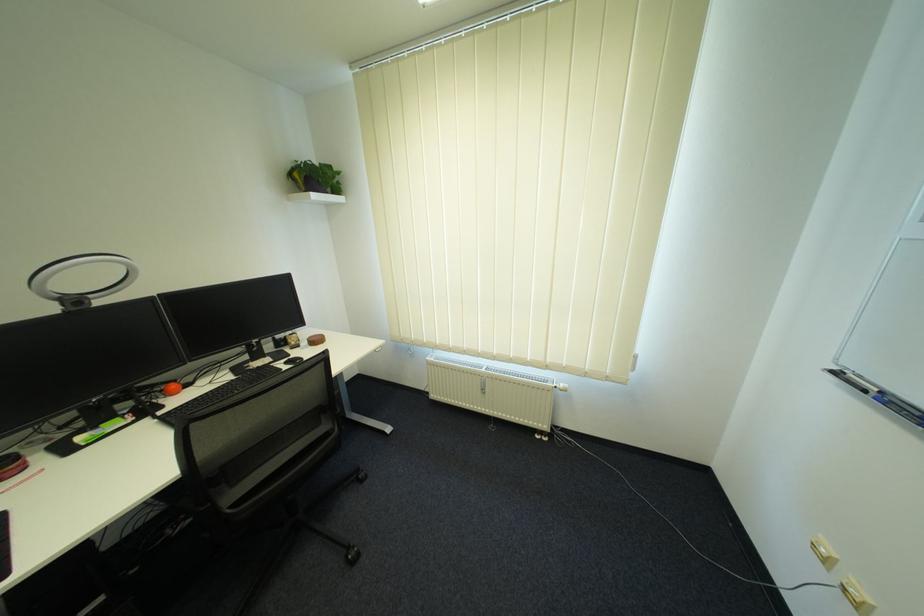
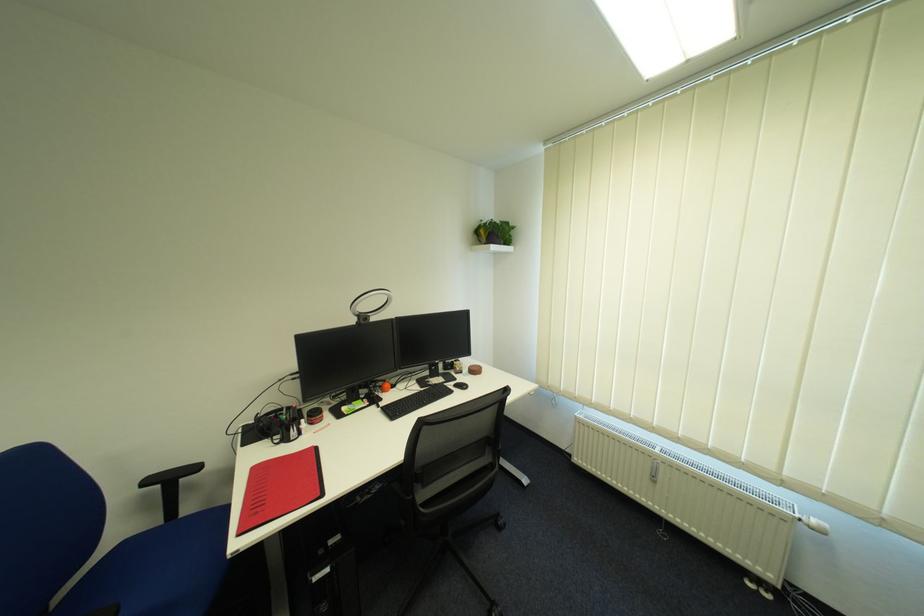
Find the pixel in the second image that matches pixel 241 496 in the first image.

(432, 496)